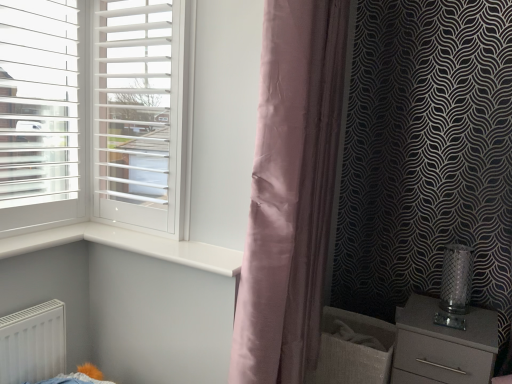
Question: In terms of size, does white matte screen door at left appear bigger or smaller than silky pink curtain at center?

Choices:
 (A) big
 (B) small

Answer: (B)

Question: Is white matte screen door at left taller or shorter than silky pink curtain at center?

Choices:
 (A) tall
 (B) short

Answer: (B)

Question: Which object is the farthest from the white matte screen door at left?

Choices:
 (A) white glossy window sill at center
 (B) silky pink curtain at center
 (C) satin grey chest of drawers at lower right

Answer: (C)

Question: Considering the real-world distances, which object is farthest from the silky pink curtain at center?

Choices:
 (A) white matte screen door at left
 (B) white glossy window sill at center
 (C) satin grey chest of drawers at lower right

Answer: (C)